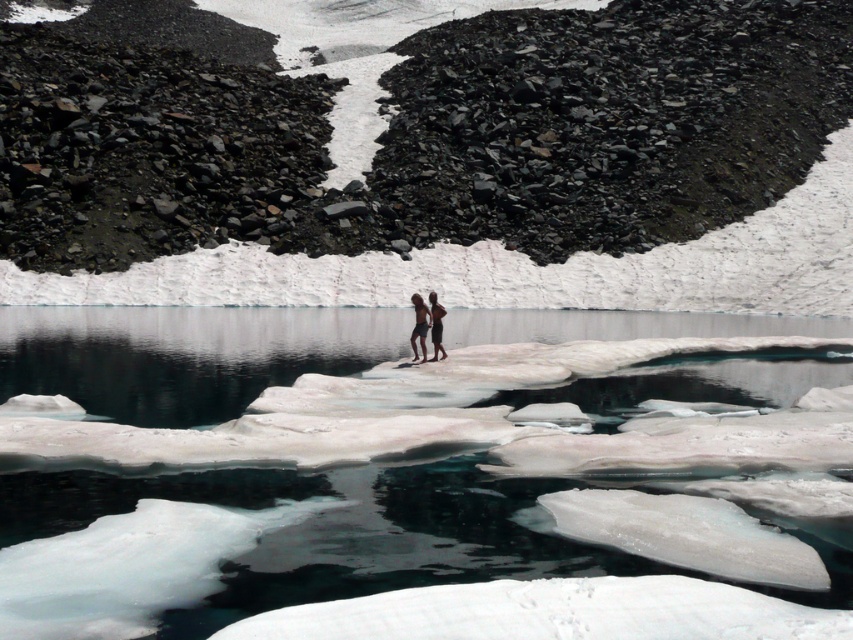
Question: Based on their relative distances, which object is farther from the clear ice at center?

Choices:
 (A) tan skin at center
 (B) skinny jeans at center

Answer: (B)

Question: Can you confirm if tan skin at center is smaller than skinny jeans at center?

Choices:
 (A) no
 (B) yes

Answer: (A)

Question: Can you confirm if tan skin at center is positioned above skinny jeans at center?

Choices:
 (A) yes
 (B) no

Answer: (B)

Question: Which point is farther from the camera taking this photo?

Choices:
 (A) (440, 349)
 (B) (410, 342)

Answer: (A)

Question: Which of the following is the farthest from the observer?

Choices:
 (A) (421, 308)
 (B) (815, 602)
 (C) (438, 333)

Answer: (C)

Question: Where is tan skin at center located in relation to skinny jeans at center in the image?

Choices:
 (A) above
 (B) below

Answer: (B)